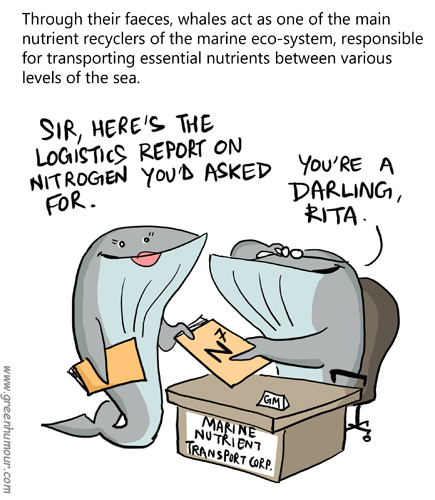
Locate an element on the screen. This screenshot has width=435, height=500. the armrest is located at coordinates (350, 375).